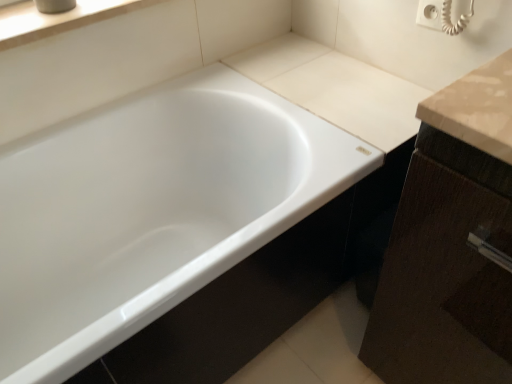
Question: Considering the relative positions of white glossy bathtub at center and white smooth window sill at upper left in the image provided, is white glossy bathtub at center to the left of white smooth window sill at upper left from the viewer's perspective?

Choices:
 (A) yes
 (B) no

Answer: (B)

Question: Is white smooth window sill at upper left surrounded by white glossy bathtub at center?

Choices:
 (A) yes
 (B) no

Answer: (B)

Question: Are white glossy bathtub at center and white smooth window sill at upper left making contact?

Choices:
 (A) no
 (B) yes

Answer: (A)

Question: Is there a large distance between white glossy bathtub at center and white smooth window sill at upper left?

Choices:
 (A) no
 (B) yes

Answer: (A)

Question: Is the position of white glossy bathtub at center more distant than that of white smooth window sill at upper left?

Choices:
 (A) yes
 (B) no

Answer: (B)

Question: Is white glossy bathtub at center smaller than white smooth window sill at upper left?

Choices:
 (A) yes
 (B) no

Answer: (B)

Question: From a real-world perspective, is white smooth window sill at upper left below white glossy bathtub at center?

Choices:
 (A) no
 (B) yes

Answer: (A)

Question: Does white smooth window sill at upper left come behind white glossy bathtub at center?

Choices:
 (A) no
 (B) yes

Answer: (B)

Question: Considering the relative positions of white smooth window sill at upper left and white glossy bathtub at center in the image provided, is white smooth window sill at upper left to the left of white glossy bathtub at center from the viewer's perspective?

Choices:
 (A) yes
 (B) no

Answer: (A)

Question: Can you confirm if white smooth window sill at upper left is taller than white glossy bathtub at center?

Choices:
 (A) yes
 (B) no

Answer: (B)

Question: From the image's perspective, would you say white smooth window sill at upper left is shown under white glossy bathtub at center?

Choices:
 (A) yes
 (B) no

Answer: (B)

Question: Is white glossy bathtub at center at the back of white smooth window sill at upper left?

Choices:
 (A) yes
 (B) no

Answer: (B)

Question: From their relative heights in the image, would you say white glossy bathtub at center is taller or shorter than white smooth window sill at upper left?

Choices:
 (A) short
 (B) tall

Answer: (B)